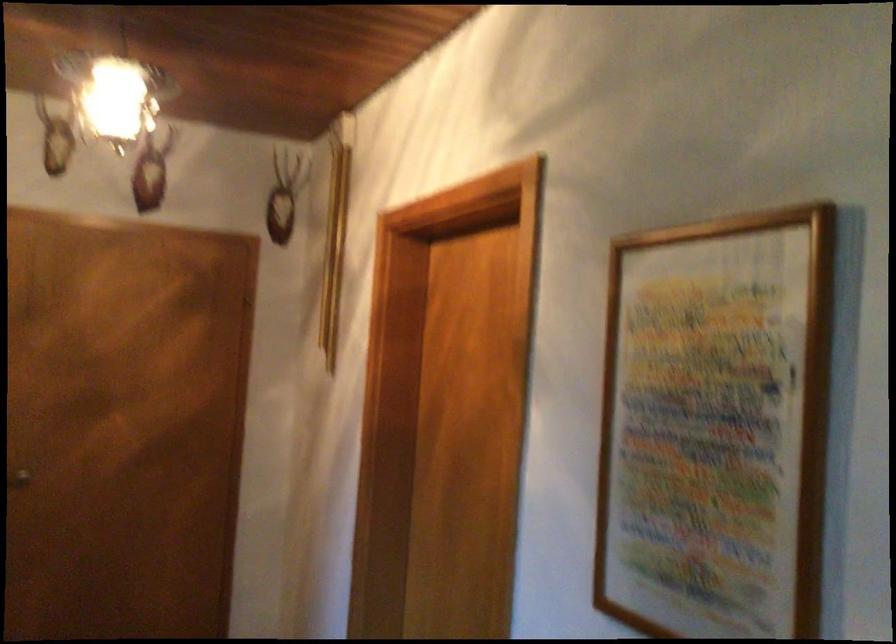
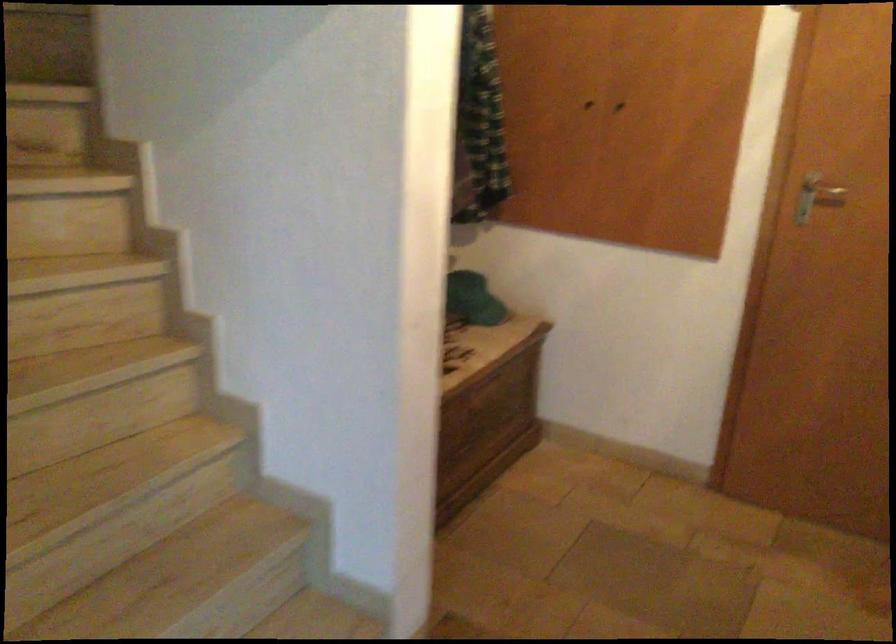
From the picture: Based on the continuous images, in which direction is the camera rotating?

The rotation direction of the camera is left-down.